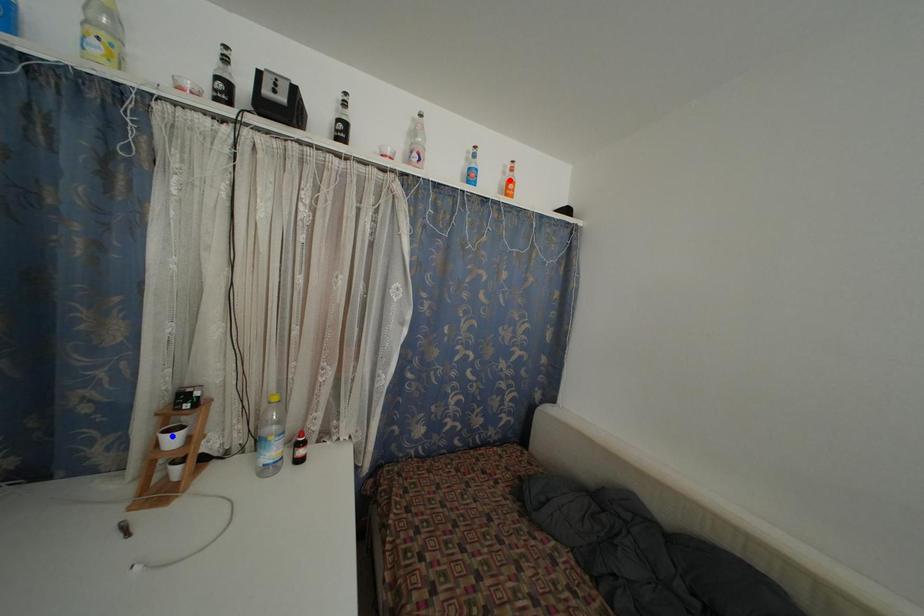
Question: In the image, two points are highlighted. Which point is nearer to the camera? Reply with the corresponding letter.

Choices:
 (A) blue point
 (B) red point

Answer: (A)